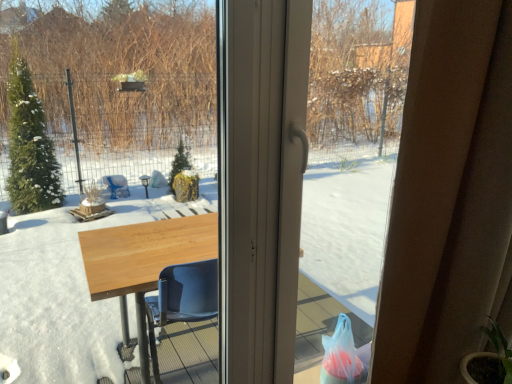
The image size is (512, 384). What do you see at coordinates (298, 185) in the screenshot?
I see `white plastic screen door at center` at bounding box center [298, 185].

What is the approximate width of white plastic screen door at center?

white plastic screen door at center is 4.01 inches in width.

Image resolution: width=512 pixels, height=384 pixels. Identify the location of white plastic screen door at center. (298, 185).

This screenshot has height=384, width=512. What are the coordinates of `white plastic screen door at center` in the screenshot? It's located at (298, 185).